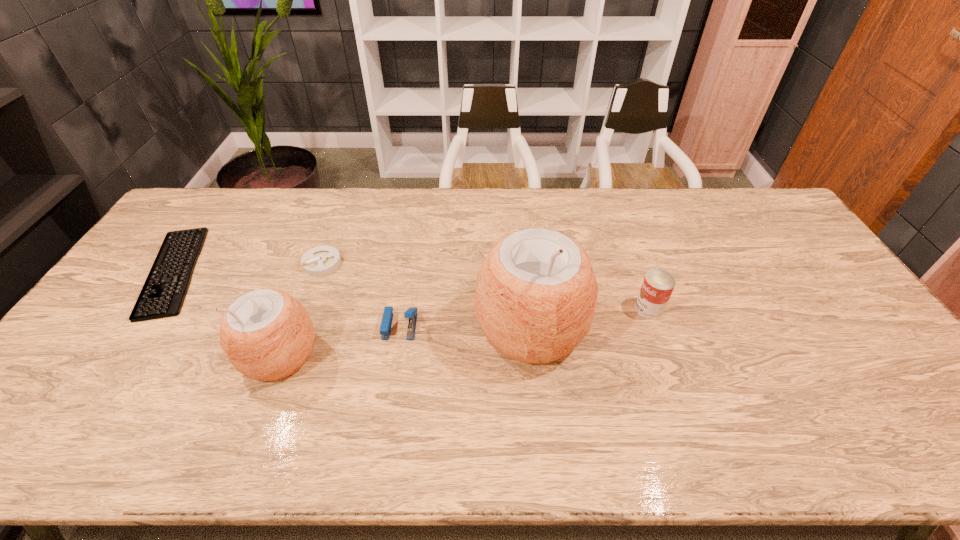
You are a GUI agent. You are given a task and a screenshot of the screen. Output one action in this format:
    pyautogui.click(x=<x>, y=<y>)
    Task: Click on the third tallest object
    
    Given the screenshot: What is the action you would take?
    pyautogui.click(x=658, y=285)

Where is `free space located 0.070m on the back of the left coconut`? free space located 0.070m on the back of the left coconut is located at coordinates (299, 305).

Identify the location of free region located on the right of the fifth object from left to right. The image size is (960, 540). (718, 328).

Find the location of a particular element. Image resolution: width=960 pixels, height=540 pixels. blank area located 0.100m on the back of the shortest object is located at coordinates point(215,212).

Identify the location of vacant space located on the right of the fifth tallest object. The height and width of the screenshot is (540, 960). tap(449, 263).

Find the location of a particular element. vacant space positioned on the right of the fourth tallest object is located at coordinates (533, 326).

Locate an element on the screen. This screenshot has height=540, width=960. free space located on the front label of the rightmost object is located at coordinates (564, 308).

Locate an element on the screen. free region located 0.120m on the front label of the rightmost object is located at coordinates [x=593, y=308].

Find the location of `free space located on the front label of the rightmost object`. free space located on the front label of the rightmost object is located at coordinates (568, 308).

Where is `object present at the near edge`? This screenshot has width=960, height=540. object present at the near edge is located at coordinates (267, 334).